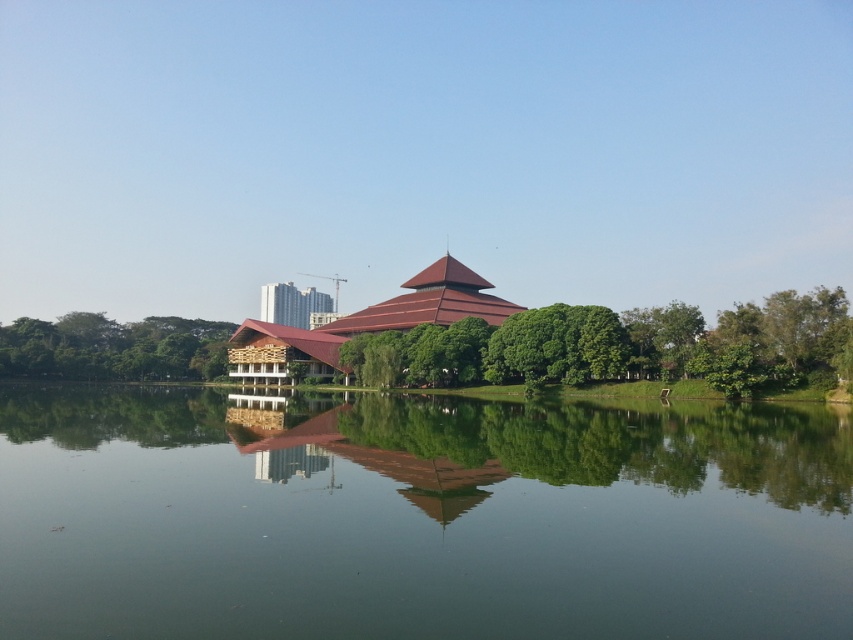
Does green leafy tree at center lie in front of metallic glass building at center?

That is True.

Is the position of green leafy tree at center more distant than that of metallic glass building at center?

No, it is not.

Who is more distant from viewer, (837,324) or (289,301)?

The point (289,301) is behind.

The height and width of the screenshot is (640, 853). I want to click on green leafy tree at center, so click(630, 346).

Which is behind, point (596, 492) or point (395, 321)?

The point (395, 321) is behind.

Between point (474, 584) and point (495, 314), which one is positioned in front?

Point (474, 584)

Is point (85, 442) in front of point (329, 358)?

That is True.

This screenshot has width=853, height=640. Identify the location of transparent water at center. (418, 516).

Is matte brown temple at center taller than metallic glass building at center?

No.

Who is shorter, matte brown temple at center or metallic glass building at center?

matte brown temple at center is shorter.

Is point (247, 339) closer to camera compared to point (306, 301)?

Yes, point (247, 339) is in front of point (306, 301).

Identify the location of matte brown temple at center. (364, 323).